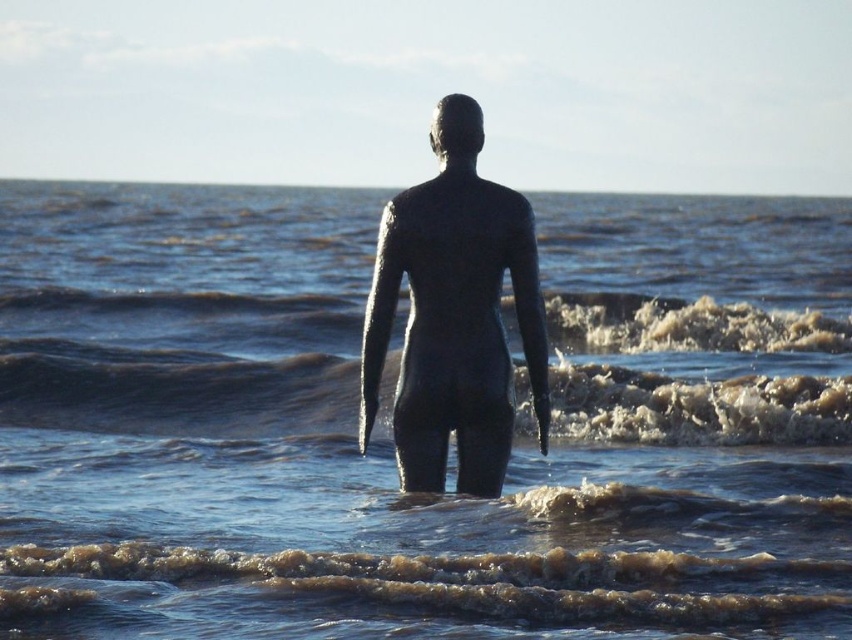
Who is lower down, brown textured water at center or bronze statue at center?

brown textured water at center is below.

Is point (603, 438) positioned behind point (441, 403)?

Yes, it is.

Which is behind, point (756, 381) or point (493, 292)?

The point (756, 381) is more distant.

This screenshot has width=852, height=640. What are the coordinates of `brown textured water at center` in the screenshot? It's located at (173, 388).

Can you confirm if shiny metallic water at center is shorter than brown textured water at center?

No, shiny metallic water at center is not shorter than brown textured water at center.

Between point (749, 326) and point (809, 436), which one is positioned behind?

Point (749, 326)

You are a GUI agent. You are given a task and a screenshot of the screen. Output one action in this format:
    pyautogui.click(x=<x>, y=<y>)
    Task: Click on the shiny metallic water at center
    The image size is (852, 640).
    Given the screenshot: What is the action you would take?
    pyautogui.click(x=389, y=422)

Measure the distance between point (176, 595) and camera.

Point (176, 595) is 12.47 meters away from camera.

Between shiny metallic water at center and bronze statue at center, which one has less height?

bronze statue at center

Where is `shiny metallic water at center`? shiny metallic water at center is located at coordinates (389, 422).

Find the location of a particular element. shiny metallic water at center is located at coordinates (389, 422).